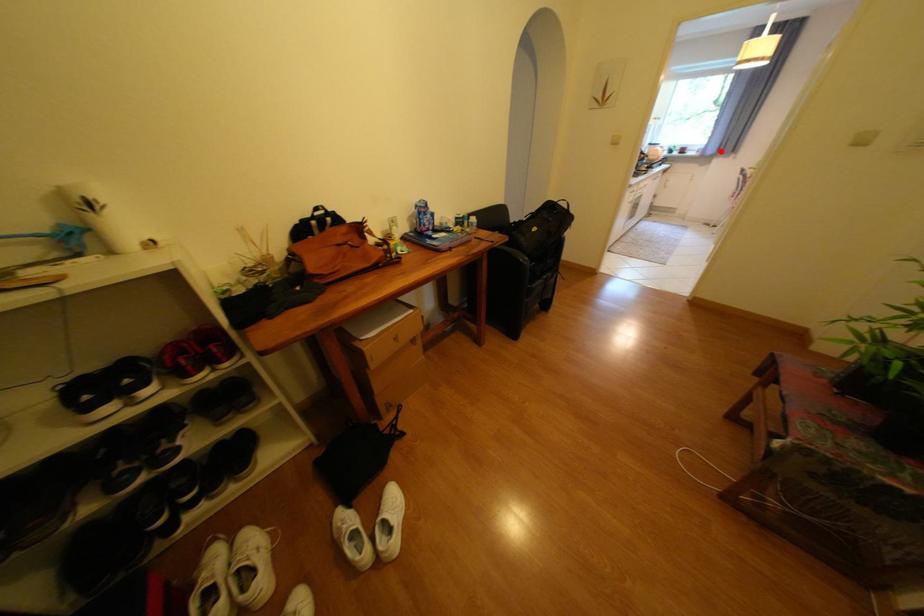
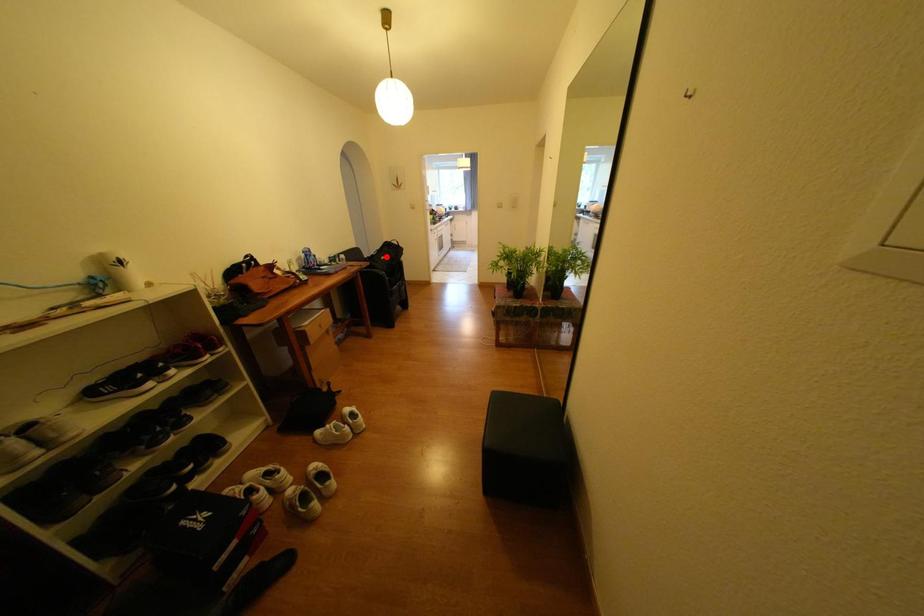
I am providing you with two images of the same scene from different viewpoints. A red point is marked on the first image and another point is marked on the second image. Are the points marked in image1 and image2 representing the same 3D position?

No